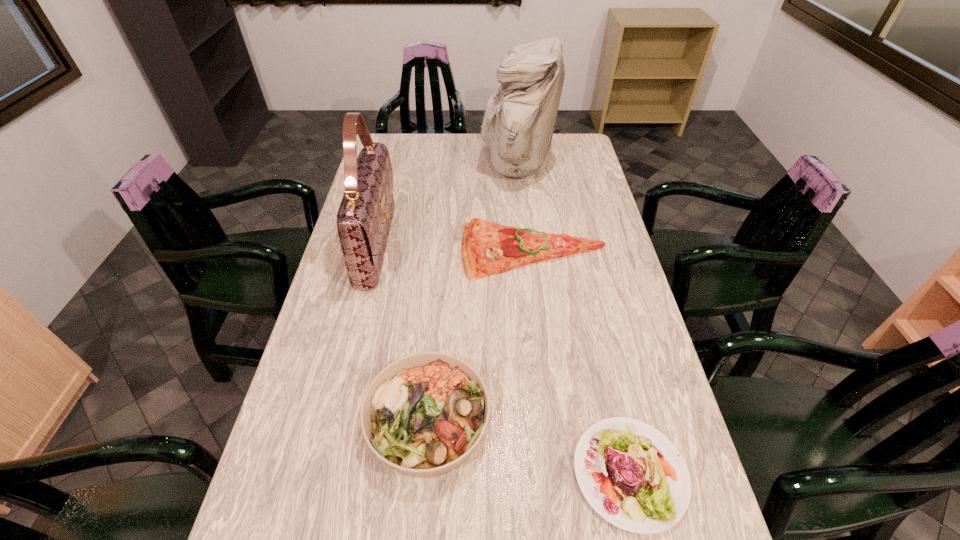
Identify the location of free space between the pizza and the backpack. (525, 208).

The width and height of the screenshot is (960, 540). In order to click on object that stands as the closest to the pizza in this screenshot , I will do `click(519, 120)`.

Find the location of a particular element. This screenshot has width=960, height=540. object that is the fourth nearest to the shorter salad plate is located at coordinates (519, 120).

The width and height of the screenshot is (960, 540). In order to click on free location that satisfies the following two spatial constraints: 1. on the front of the handbag with the clasp; 2. on the right side of the shorter salad plate in this screenshot , I will do `click(322, 473)`.

Where is `blank space that satisfies the following two spatial constraints: 1. on the front of the handbag with the clasp; 2. on the back side of the right salad plate`? blank space that satisfies the following two spatial constraints: 1. on the front of the handbag with the clasp; 2. on the back side of the right salad plate is located at coordinates (322, 473).